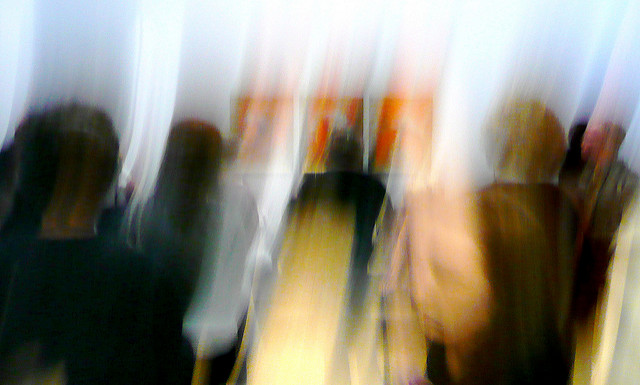
Locate an element on the screen. wall is located at coordinates (106, 51).